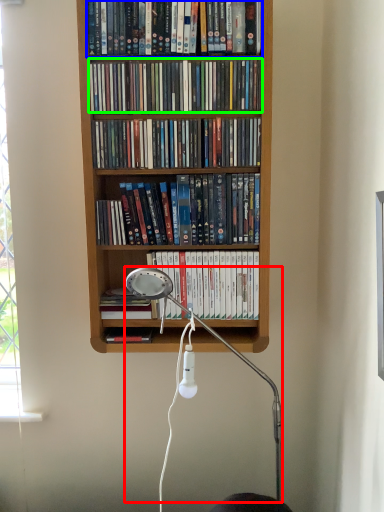
Question: Which object is positioned farthest from lamp (highlighted by a red box)? Select from book (highlighted by a blue box) and book (highlighted by a green box).

Choices:
 (A) book
 (B) book

Answer: (A)